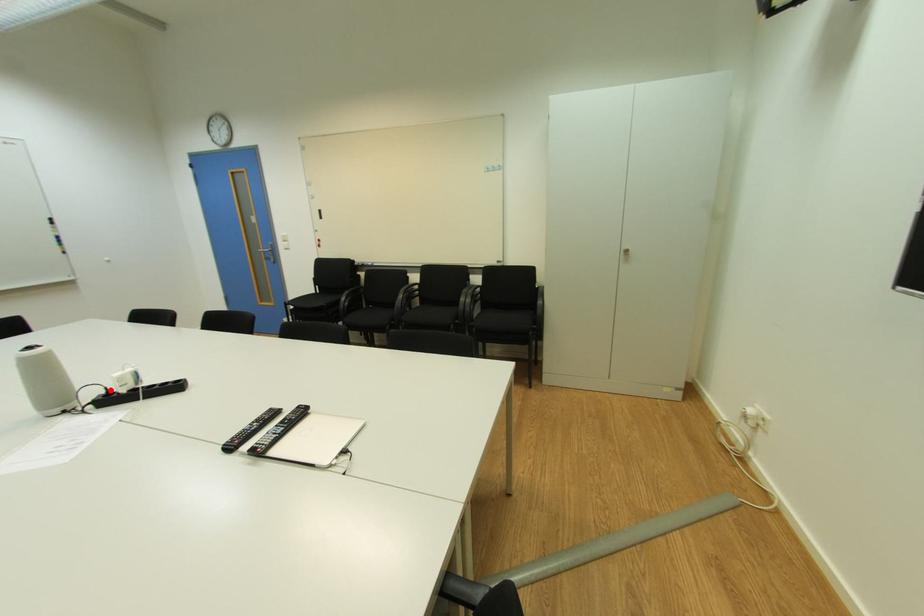
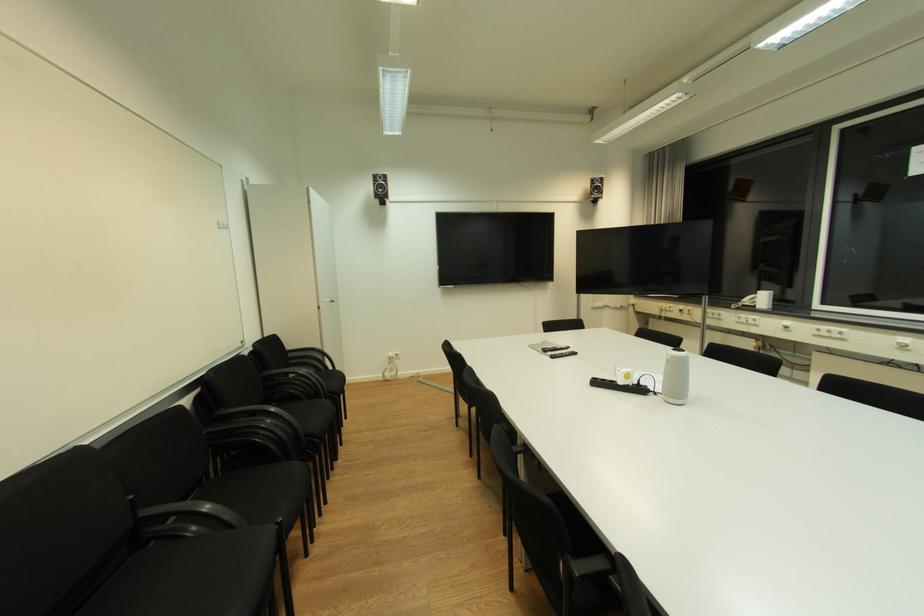
In the second image, find the point that corresponds to the highlighted location in the first image.

(645, 381)